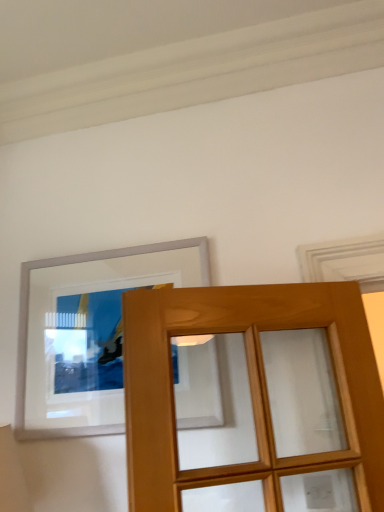
Question: Which is correct: white glossy picture frame at upper left is inside light brown wood door at center, or outside of it?

Choices:
 (A) inside
 (B) outside

Answer: (B)

Question: In the image, is white glossy picture frame at upper left on the left side or the right side of light brown wood door at center?

Choices:
 (A) left
 (B) right

Answer: (A)

Question: Considering the positions of point (34, 332) and point (210, 302), is point (34, 332) closer or farther from the camera than point (210, 302)?

Choices:
 (A) closer
 (B) farther

Answer: (B)

Question: From the image's perspective, relative to white glossy picture frame at upper left, is light brown wood door at center above or below?

Choices:
 (A) above
 (B) below

Answer: (B)

Question: Considering the positions of light brown wood door at center and white glossy picture frame at upper left in the image, is light brown wood door at center taller or shorter than white glossy picture frame at upper left?

Choices:
 (A) short
 (B) tall

Answer: (B)

Question: Is light brown wood door at center wider or thinner than white glossy picture frame at upper left?

Choices:
 (A) wide
 (B) thin

Answer: (A)

Question: Would you say light brown wood door at center is to the left or to the right of white glossy picture frame at upper left in the picture?

Choices:
 (A) right
 (B) left

Answer: (A)